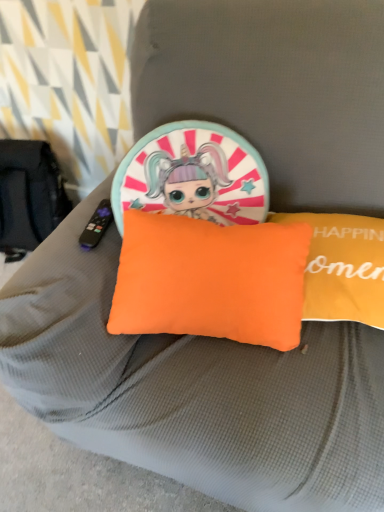
Locate an element on the screen. free point above orange fabric pillow at center, the second pillow when ordered from right to left (from a real-world perspective) is located at coordinates (202, 238).